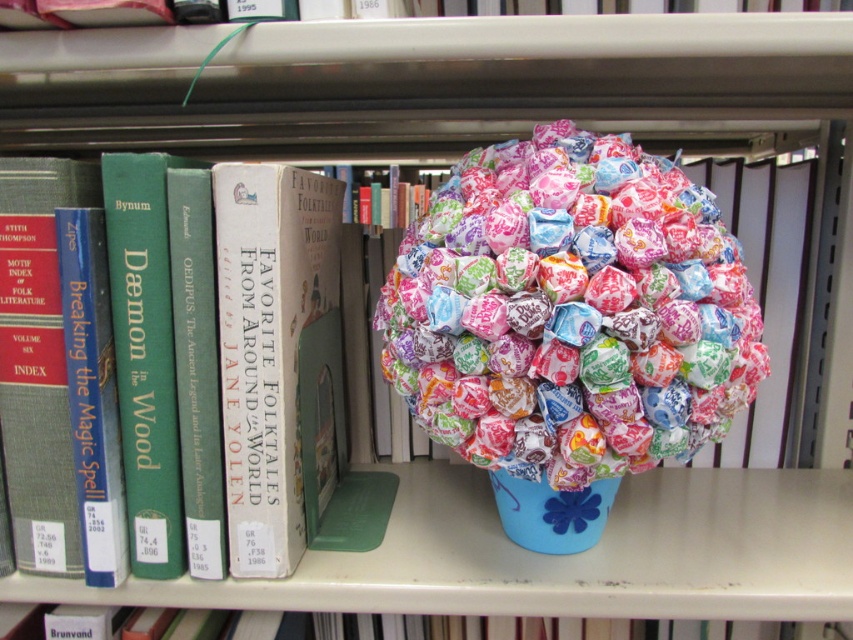
Does colorful paper wrapped at center have a greater width compared to hardcover book at left?

Yes, colorful paper wrapped at center is wider than hardcover book at left.

Can you confirm if colorful paper wrapped at center is positioned to the left of hardcover book at left?

In fact, colorful paper wrapped at center is to the right of hardcover book at left.

Which is behind, point (589, 154) or point (54, 506)?

Point (54, 506)

The height and width of the screenshot is (640, 853). Find the location of `colorful paper wrapped at center`. colorful paper wrapped at center is located at coordinates (572, 310).